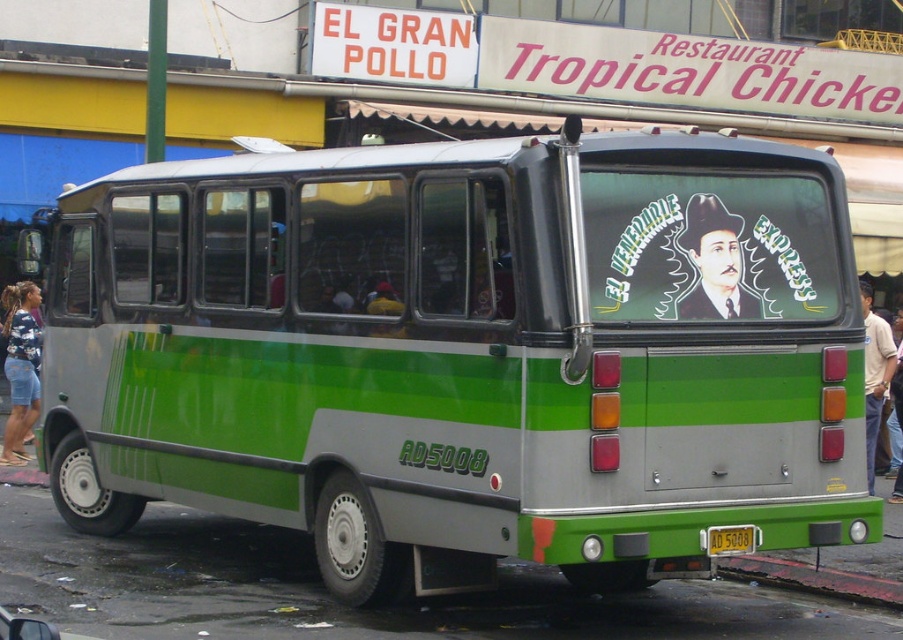
Question: From the image, what is the correct spatial relationship of green matte bus at center in relation to brick red sidewalk at lower right?

Choices:
 (A) above
 (B) below

Answer: (A)

Question: Does smooth black hat at rear center appear over brick red sidewalk at lower right?

Choices:
 (A) no
 (B) yes

Answer: (B)

Question: Among these objects, which one is nearest to the camera?

Choices:
 (A) yellow plastic license plate at rear
 (B) smooth black hat at rear center

Answer: (A)

Question: Considering the real-world distances, which object is closest to the light brown shirt at right?

Choices:
 (A) yellow plastic license plate at rear
 (B) smooth black hat at rear center
 (C) denim shorts at left

Answer: (A)

Question: Is smooth black hat at rear center positioned in front of brick red sidewalk at lower right?

Choices:
 (A) yes
 (B) no

Answer: (A)

Question: Which object is the farthest from the light brown shirt at right?

Choices:
 (A) green matte bus at center
 (B) yellow plastic license plate at rear
 (C) brick red sidewalk at lower right

Answer: (A)